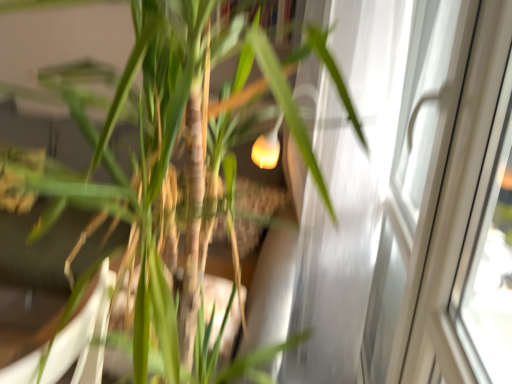
Question: In terms of size, does white glossy screen door at right appear bigger or smaller than green matte bamboo at center?

Choices:
 (A) big
 (B) small

Answer: (B)

Question: Is point (437, 147) closer or farther from the camera than point (166, 36)?

Choices:
 (A) closer
 (B) farther

Answer: (B)

Question: Do you think white glossy screen door at right is within green matte bamboo at center, or outside of it?

Choices:
 (A) outside
 (B) inside

Answer: (A)

Question: Is green matte bamboo at center taller or shorter than white glossy screen door at right?

Choices:
 (A) short
 (B) tall

Answer: (A)

Question: Is green matte bamboo at center in front of or behind white glossy screen door at right in the image?

Choices:
 (A) front
 (B) behind

Answer: (A)

Question: From the image's perspective, is green matte bamboo at center positioned above or below white glossy screen door at right?

Choices:
 (A) below
 (B) above

Answer: (A)

Question: Is green matte bamboo at center wider or thinner than white glossy screen door at right?

Choices:
 (A) thin
 (B) wide

Answer: (B)